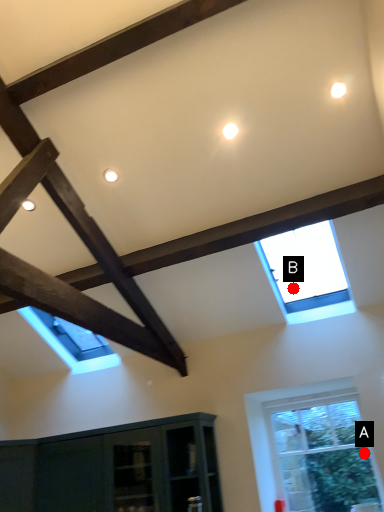
Question: Two points are circled on the image, labeled by A and B beside each circle. Among these points, which one is farthest from the camera?

Choices:
 (A) A is further
 (B) B is further

Answer: (B)